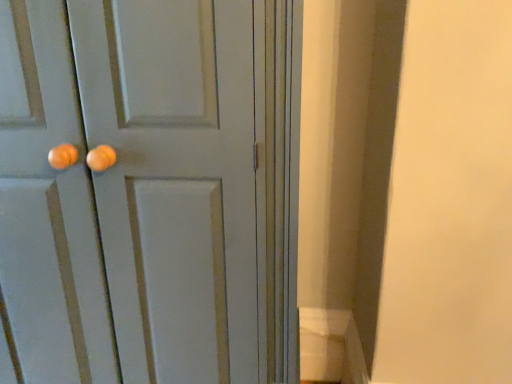
Where is `matte gray door at center`? matte gray door at center is located at coordinates (133, 191).

This screenshot has width=512, height=384. Describe the element at coordinates (133, 191) in the screenshot. I see `matte gray door at center` at that location.

Image resolution: width=512 pixels, height=384 pixels. I want to click on matte gray door at center, so click(x=133, y=191).